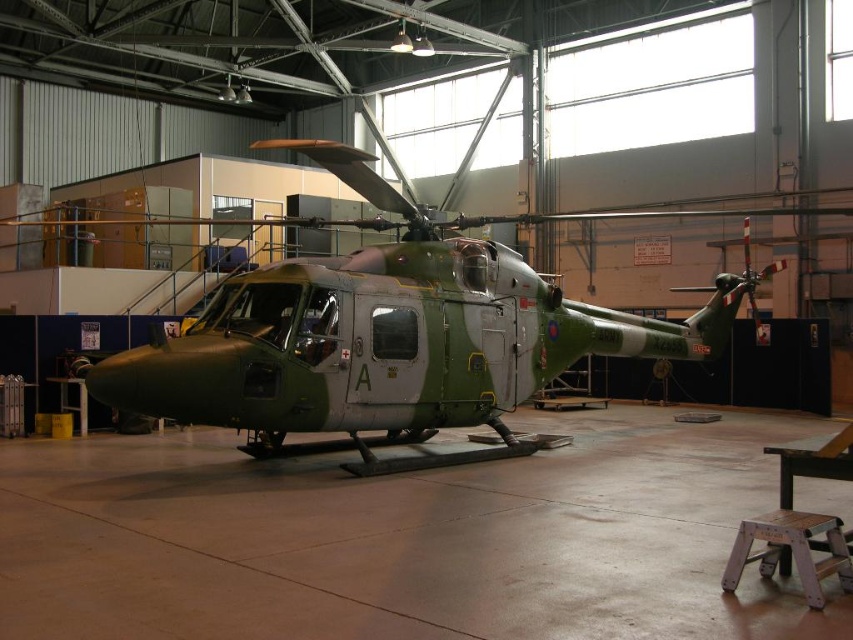
Does point (314, 394) come closer to viewer compared to point (834, 531)?

No, it is not.

In the scene shown: Between camouflage paint helicopter at center and wooden stool at lower right, which one is positioned lower?

wooden stool at lower right is below.

You are a GUI agent. You are given a task and a screenshot of the screen. Output one action in this format:
    pyautogui.click(x=<x>, y=<y>)
    Task: Click on the camouflage paint helicopter at center
    The image size is (853, 640).
    Given the screenshot: What is the action you would take?
    pyautogui.click(x=390, y=333)